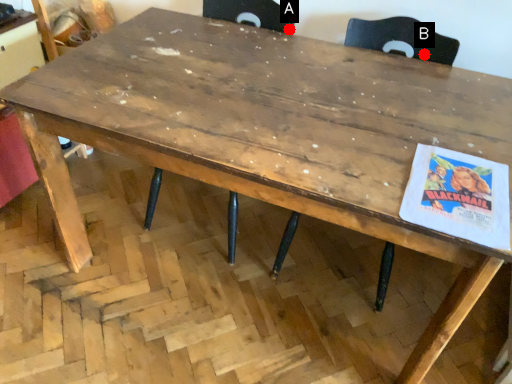
Question: Two points are circled on the image, labeled by A and B beside each circle. Among these points, which one is farthest from the camera?

Choices:
 (A) A is further
 (B) B is further

Answer: (A)